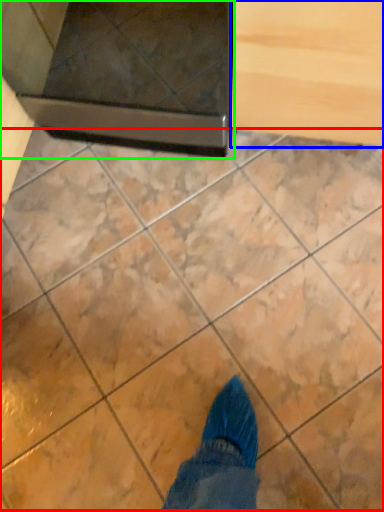
Question: Based on their relative distances, which object is nearer to marble (highlighted by a red box)? Choose from drawer (highlighted by a blue box) and appliance (highlighted by a green box).

Choices:
 (A) drawer
 (B) appliance

Answer: (B)